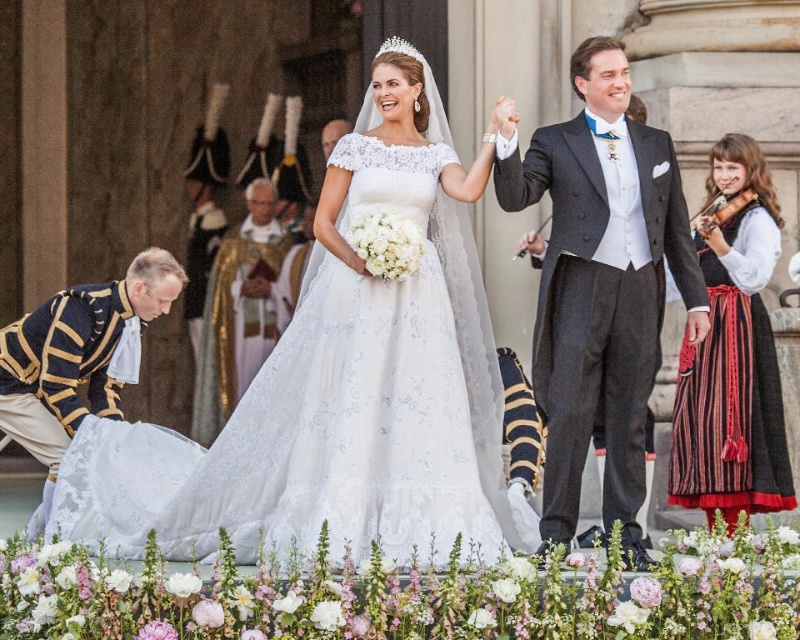
Measure the distance from lace fabric wedding dress at center to striped cotton dress at right.

11.74 meters

Can you confirm if lace fabric wedding dress at center is taller than striped cotton dress at right?

Yes.

Find the location of a particular element. The image size is (800, 640). lace fabric wedding dress at center is located at coordinates (344, 381).

Does matte black suit at upper right come in front of striped cotton dress at right?

Yes, it is in front of striped cotton dress at right.

Which of these two, matte black suit at upper right or striped cotton dress at right, stands taller?

With more height is matte black suit at upper right.

The width and height of the screenshot is (800, 640). What do you see at coordinates (600, 282) in the screenshot?
I see `matte black suit at upper right` at bounding box center [600, 282].

At what (x,y) coordinates should I click in order to perform the action: click on matte black suit at upper right. Please return your answer as a coordinate pair (x, y). This screenshot has width=800, height=640. Looking at the image, I should click on (600, 282).

Between matte black suit at upper right and clear crystal tiara at upper center, which one has less height?

Standing shorter between the two is clear crystal tiara at upper center.

Is matte black suit at upper right taller than clear crystal tiara at upper center?

Indeed, matte black suit at upper right has a greater height compared to clear crystal tiara at upper center.

Which is in front, point (600, 49) or point (405, 42)?

Point (600, 49) is in front.

Identify the location of matte black suit at upper right. Image resolution: width=800 pixels, height=640 pixels. (600, 282).